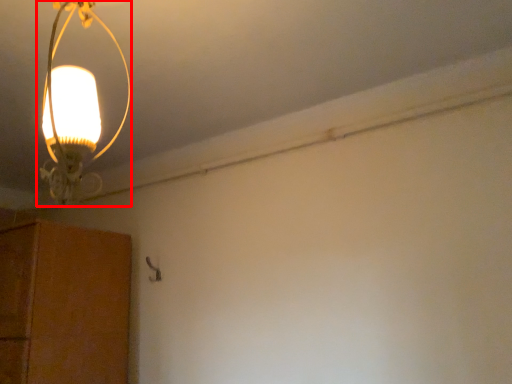
Question: From the image's perspective, what is the correct spatial positioning of lamp (annotated by the red box) in reference to cabinetry?

Choices:
 (A) above
 (B) below

Answer: (A)